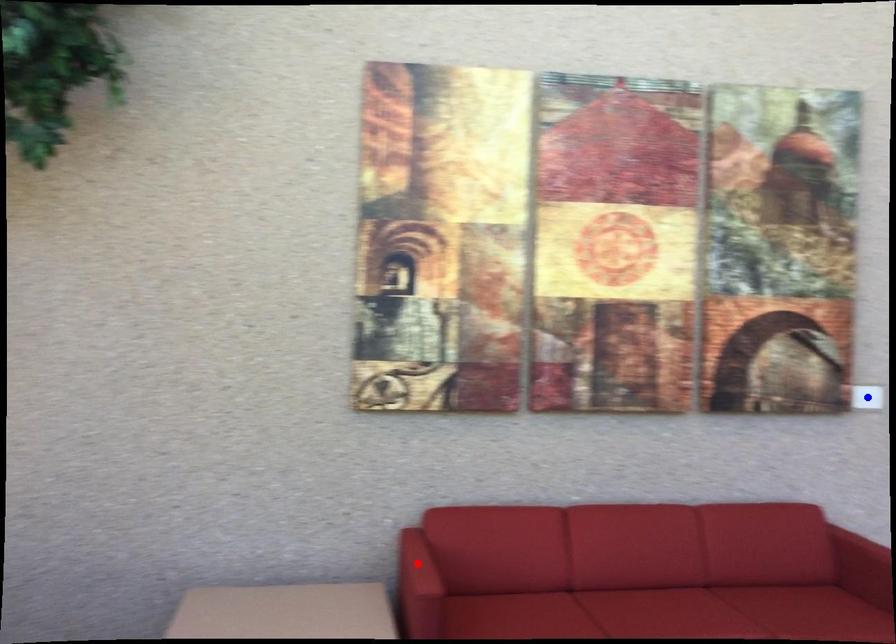
Question: Which of the two points in the image is closer to the camera?

Choices:
 (A) Blue point is closer.
 (B) Red point is closer.

Answer: (B)